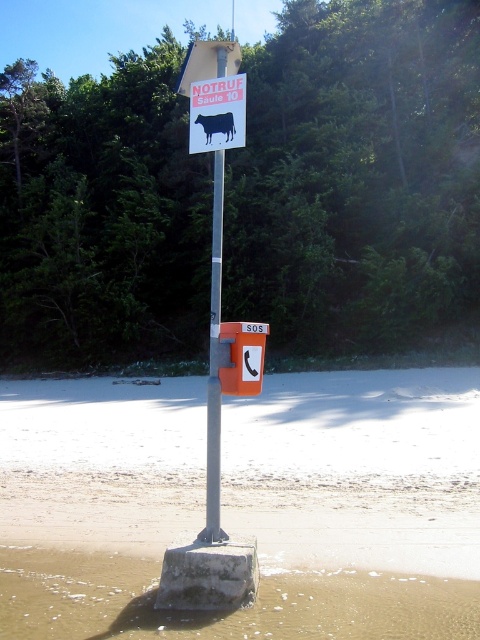
Who is positioned more to the left, silver metallic pole at center or orange plastic sos phone at center?

silver metallic pole at center is more to the left.

Who is more forward, (x=212, y=396) or (x=236, y=356)?

Point (x=212, y=396) is in front.

This screenshot has width=480, height=640. In order to click on silver metallic pole at center in this screenshot , I will do 215,365.

Is point (231, 358) positioned after point (212, 116)?

That is False.

Which is more to the left, orange plastic sos phone at center or black matte cow at center?

black matte cow at center is more to the left.

Who is more forward, [225,381] or [208,140]?

Point [225,381] is in front.

Find the location of a particular element. Image resolution: width=480 pixels, height=640 pixels. orange plastic sos phone at center is located at coordinates (241, 356).

Who is more distant from viewer, (x=299, y=390) or (x=213, y=248)?

Positioned behind is point (x=213, y=248).

Is point (394, 493) positioned behind point (213, 307)?

Yes, it is behind point (213, 307).

Image resolution: width=480 pixels, height=640 pixels. I want to click on sandy beach at lower center, so click(358, 468).